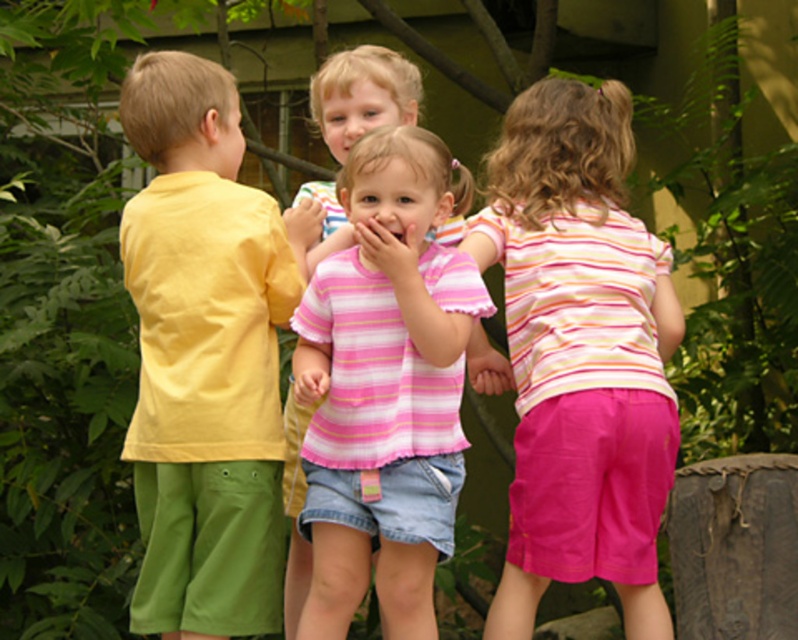
Which is above, yellow cotton shirt at left or pink cotton shorts at right?

Positioned higher is yellow cotton shirt at left.

Based on the photo, is yellow cotton shirt at left to the right of pink cotton shorts at right from the viewer's perspective?

No, yellow cotton shirt at left is not to the right of pink cotton shorts at right.

Image resolution: width=798 pixels, height=640 pixels. In order to click on yellow cotton shirt at left in this screenshot , I will do `click(204, 356)`.

This screenshot has height=640, width=798. In order to click on yellow cotton shirt at left in this screenshot , I will do `click(204, 356)`.

The width and height of the screenshot is (798, 640). Identify the location of yellow cotton shirt at left. (204, 356).

Find the location of a particular element. yellow cotton shirt at left is located at coordinates (204, 356).

Can you confirm if pink cotton shorts at right is thinner than pink striped shirt at center?

In fact, pink cotton shorts at right might be wider than pink striped shirt at center.

In the scene shown: Is pink cotton shorts at right closer to camera compared to pink striped shirt at center?

No, pink cotton shorts at right is further to the viewer.

Is point (551, 296) closer to camera compared to point (437, 388)?

That is False.

You are a GUI agent. You are given a task and a screenshot of the screen. Output one action in this format:
    pyautogui.click(x=<x>, y=<y>)
    Task: Click on the pink cotton shorts at right
    This screenshot has width=798, height=640.
    Given the screenshot: What is the action you would take?
    pyautogui.click(x=579, y=355)